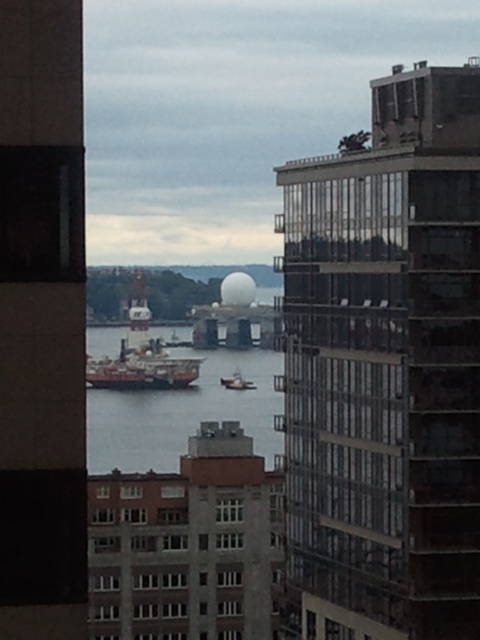
Does point (292, 198) come in front of point (38, 93)?

No, it is behind (38, 93).

Between glassy concrete building at right and smooth concrete tower at left, which one has less height?

smooth concrete tower at left

Where is `glassy concrete building at right`? The image size is (480, 640). glassy concrete building at right is located at coordinates point(384,369).

Is point (417, 566) closer to viewer compared to point (227, 406)?

Yes, it is.

Can you confirm if glassy concrete building at right is positioned to the right of clear water at center?

Indeed, glassy concrete building at right is positioned on the right side of clear water at center.

Does point (311, 592) come farther from viewer compared to point (252, 435)?

No, it is in front of (252, 435).

The image size is (480, 640). Find the location of `glassy concrete building at right`. glassy concrete building at right is located at coordinates (384, 369).

Is shiny metallic ship at center closer to camera compared to metallic gray boat at center?

Yes, shiny metallic ship at center is closer to the viewer.

How much distance is there between shiny metallic ship at center and metallic gray boat at center?

shiny metallic ship at center and metallic gray boat at center are 24.98 meters apart.

Which is behind, point (154, 371) or point (228, 380)?

The point (228, 380) is behind.

The height and width of the screenshot is (640, 480). I want to click on shiny metallic ship at center, so click(142, 369).